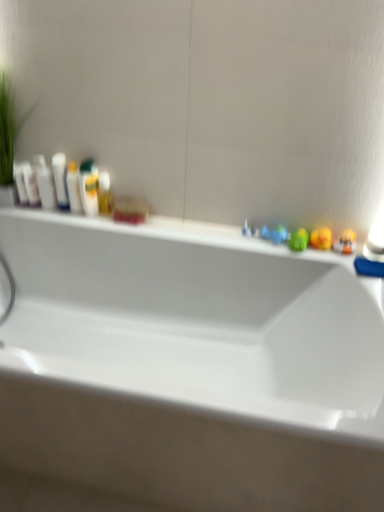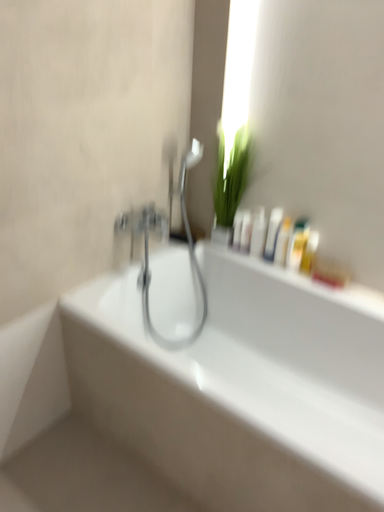
Question: Which way did the camera rotate in the video?

Choices:
 (A) rotated upward
 (B) rotated downward

Answer: (A)